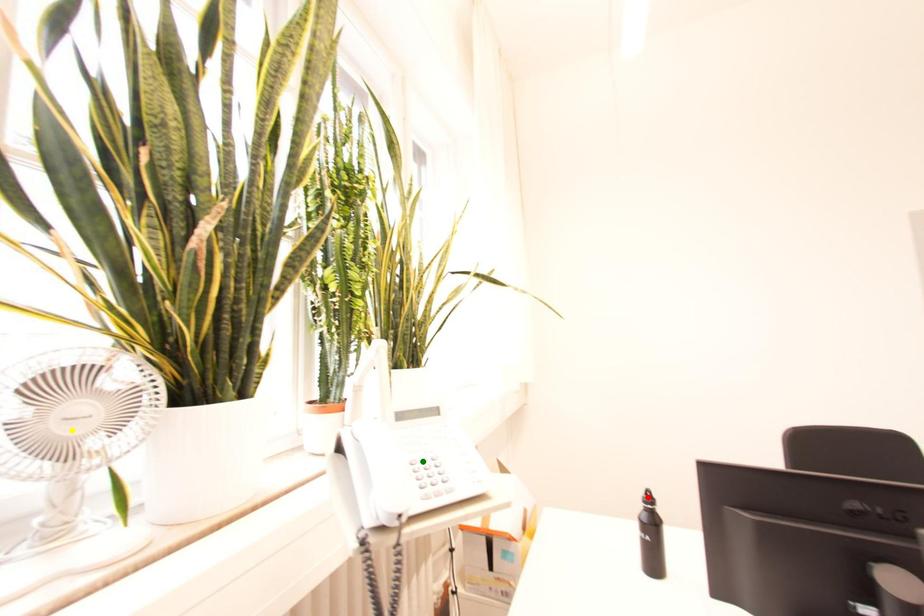
Based on the photo, order these from nearest to farthest:
- red point
- green point
- yellow point

yellow point < green point < red point